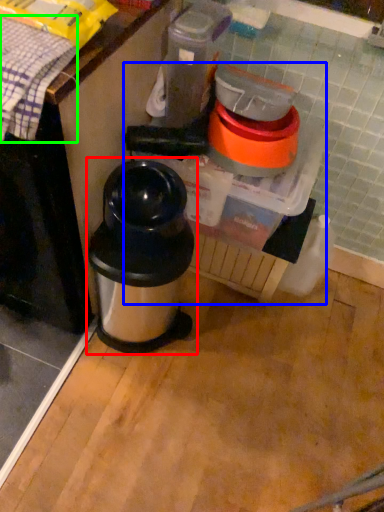
Question: Considering the real-world distances, which object is farthest from waste container (highlighted by a red box)? blender (highlighted by a blue box) or blanket (highlighted by a green box)?

Choices:
 (A) blender
 (B) blanket

Answer: (B)